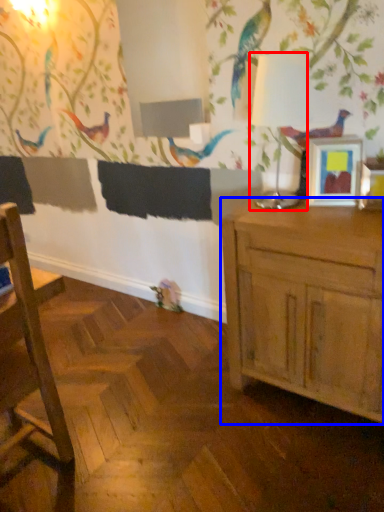
Question: Which object is further to the camera taking this photo, table lamp (highlighted by a red box) or cabinetry (highlighted by a blue box)?

Choices:
 (A) table lamp
 (B) cabinetry

Answer: (A)